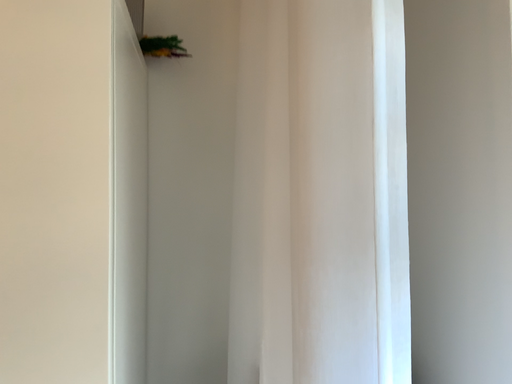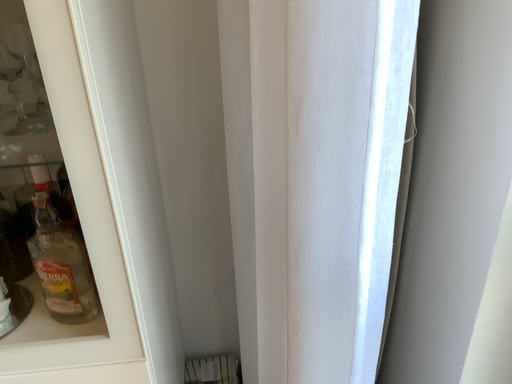
Question: Which way did the camera rotate in the video?

Choices:
 (A) rotated upward
 (B) rotated downward

Answer: (B)